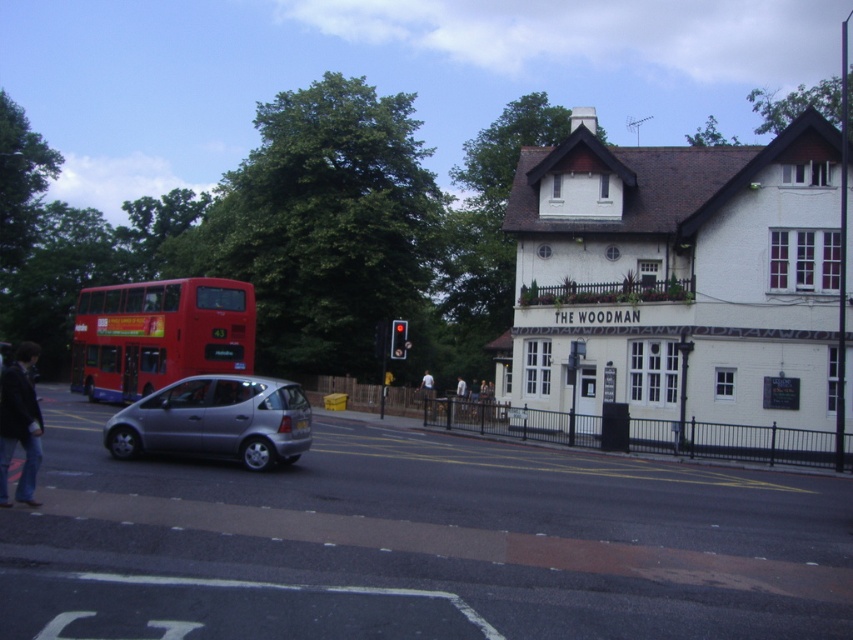
Who is positioned more to the left, red rubber double-decker bus at left or dark blue jeans at lower left?

red rubber double-decker bus at left is more to the left.

What do you see at coordinates (160, 333) in the screenshot?
I see `red rubber double-decker bus at left` at bounding box center [160, 333].

What do you see at coordinates (160, 333) in the screenshot?
I see `red rubber double-decker bus at left` at bounding box center [160, 333].

Find the location of a particular element. The height and width of the screenshot is (640, 853). red rubber double-decker bus at left is located at coordinates (160, 333).

Which is in front, point (729, 529) or point (125, 406)?

Point (729, 529)

Locate an element on the screen. This screenshot has height=640, width=853. silver metallic car at center is located at coordinates (416, 544).

Where is `silver metallic car at center`? The height and width of the screenshot is (640, 853). silver metallic car at center is located at coordinates [x=416, y=544].

Can you confirm if satin silver hatchback at center is positioned to the left of dark blue jeans at lower left?

No, satin silver hatchback at center is not to the left of dark blue jeans at lower left.

Does satin silver hatchback at center appear on the right side of dark blue jeans at lower left?

Yes, satin silver hatchback at center is to the right of dark blue jeans at lower left.

Identify the location of satin silver hatchback at center. (216, 420).

Image resolution: width=853 pixels, height=640 pixels. What are the coordinates of `satin silver hatchback at center` in the screenshot? It's located at (216, 420).